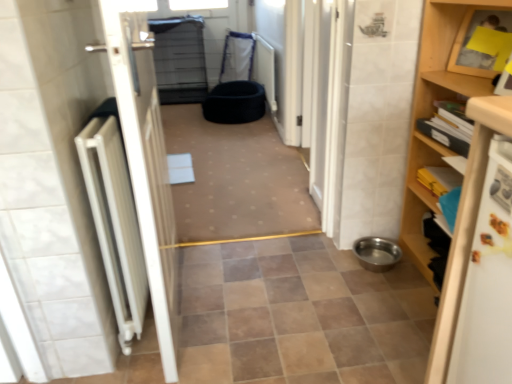
At what (x,y) coordinates should I click in order to perform the action: click on vacant area that lies between metallic stainless steel bowl at lower right, the first toilet bowl in the front-to-back sequence, and white metallic radiator at left. Please return your answer as a coordinate pair (x, y). Image resolution: width=512 pixels, height=384 pixels. Looking at the image, I should click on (273, 288).